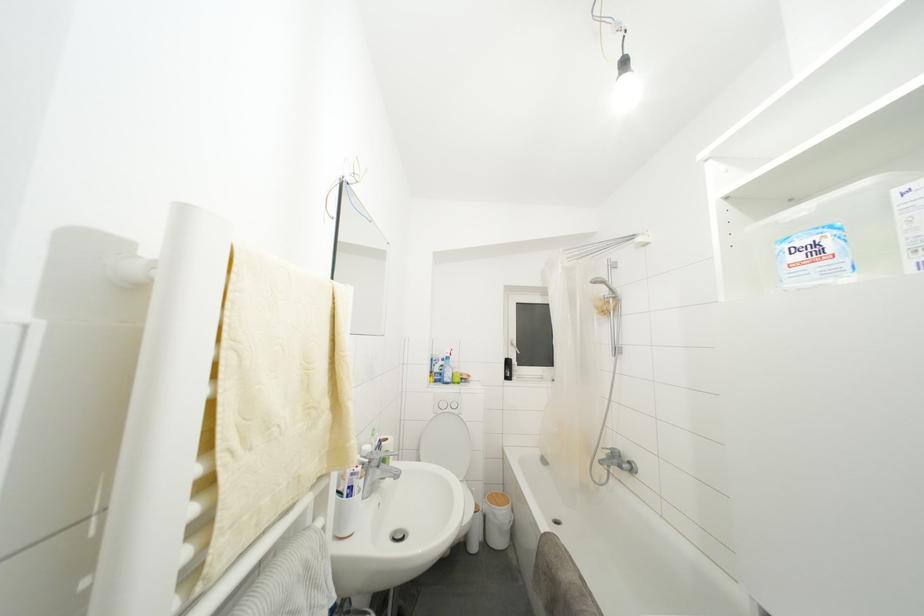
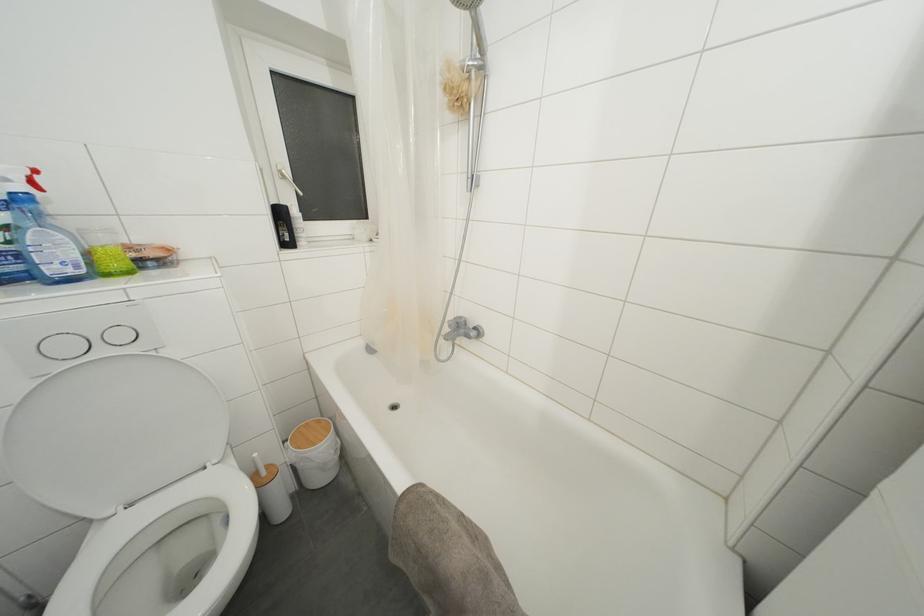
Find the pixel in the second image that matches (x=612, y=291) in the first image.

(480, 31)